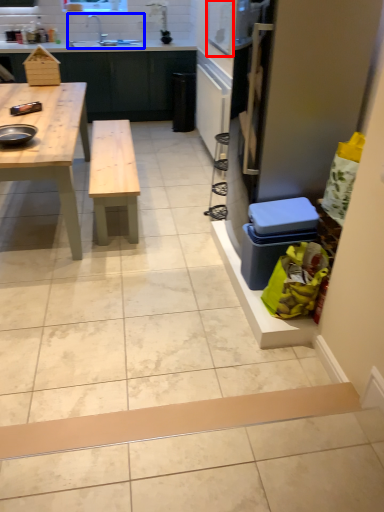
Question: Among these objects, which one is nearest to the camera, window screen (highlighted by a red box) or sink (highlighted by a blue box)?

Choices:
 (A) window screen
 (B) sink

Answer: (A)